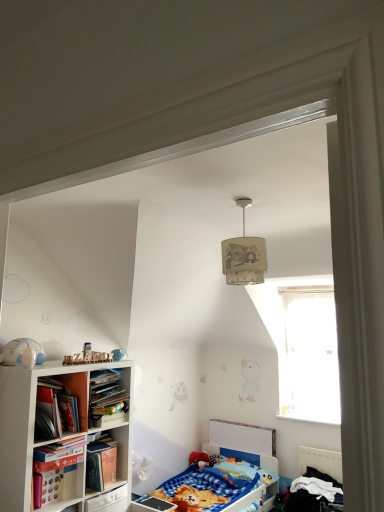
Question: Is point (215, 484) positioned closer to the camera than point (38, 382)?

Choices:
 (A) farther
 (B) closer

Answer: (A)

Question: From a real-world perspective, is blue fabric bed at lower center, which appears as the 2th bed when viewed from the right, physically located above or below hardcover book at left, acting as the first book starting from the top?

Choices:
 (A) above
 (B) below

Answer: (B)

Question: Which of these objects is positioned farthest from the white matte bookcase at left?

Choices:
 (A) blue cotton bed at lower right, placed as the second bed when sorted from left to right
 (B) hardcover book at left, the 2th book from the bottom
 (C) hardcover book at lower left, positioned as the 2th book in top-to-bottom order
 (D) white matte toy at left
 (E) transparent glass window at upper right

Answer: (A)

Question: Which object is the farthest from the beige fabric lampshade at upper center?

Choices:
 (A) blue fabric bed at lower center, which appears as the 2th bed when viewed from the right
 (B) hardcover book at lower left, which is the first book from bottom to top
 (C) white matte bookcase at left
 (D) blue cotton bed at lower right, which is counted as the first bed, starting from the right
 (E) hardcover book at left, acting as the first book starting from the top

Answer: (A)